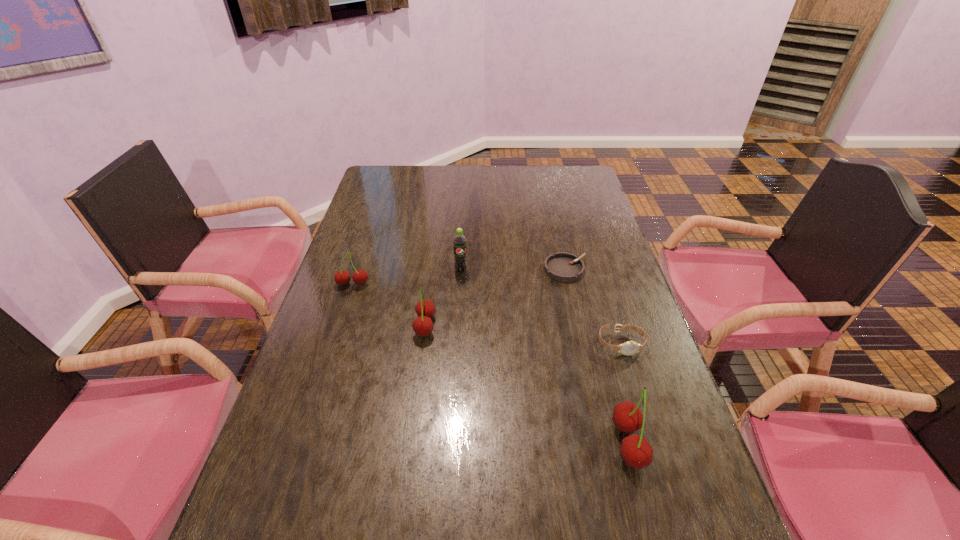
This screenshot has width=960, height=540. Identify the location of vacant area that lies between the second tallest cherry and the shortest object. (495, 298).

At what (x,y) coordinates should I click in order to perform the action: click on free space between the fourth object from right to left and the second shortest object. Please return your answer as a coordinate pair (x, y). The width and height of the screenshot is (960, 540). Looking at the image, I should click on (540, 307).

Find the location of a particular element. The image size is (960, 540). vacant space in between the third object from left to right and the ashtray is located at coordinates (514, 270).

Identify the location of free space between the nearest cherry and the fourth object from right to left. (544, 357).

Locate an element on the screen. This screenshot has height=540, width=960. vacant area that lies between the soda and the shortest object is located at coordinates (514, 270).

This screenshot has width=960, height=540. Find the location of `free space between the second shortest object and the soda`. free space between the second shortest object and the soda is located at coordinates click(x=540, y=307).

The height and width of the screenshot is (540, 960). In order to click on vacant point located between the watch and the fourth object from right to left in this screenshot , I will do `click(540, 307)`.

Where is `vacant point located between the second shortest object and the second nearest cherry`? The image size is (960, 540). vacant point located between the second shortest object and the second nearest cherry is located at coordinates (523, 335).

Locate which object ranks fifth in proximity to the rightmost cherry. Please provide its 2D coordinates. Your answer should be formatted as a tuple, i.e. [(x, y)], where the tuple contains the x and y coordinates of a point satisfying the conditions above.

[(359, 277)]

Identify the location of object that can be found as the fifth closest to the farthest cherry. (636, 452).